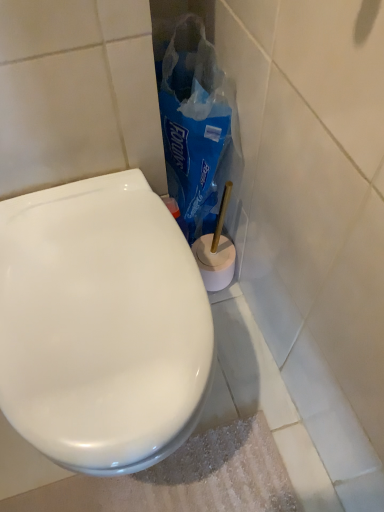
Question: Does white glossy toilet seat at center appear on the right side of blue plastic bag at center?

Choices:
 (A) no
 (B) yes

Answer: (A)

Question: From a real-world perspective, does white glossy toilet seat at center stand above blue plastic bag at center?

Choices:
 (A) yes
 (B) no

Answer: (B)

Question: Is white glossy toilet seat at center at the left side of blue plastic bag at center?

Choices:
 (A) yes
 (B) no

Answer: (A)

Question: Would you say white glossy toilet seat at center contains blue plastic bag at center?

Choices:
 (A) yes
 (B) no

Answer: (B)

Question: Is the depth of white glossy toilet seat at center greater than that of blue plastic bag at center?

Choices:
 (A) no
 (B) yes

Answer: (A)

Question: Is white glossy toilet seat at center with blue plastic bag at center?

Choices:
 (A) no
 (B) yes

Answer: (A)

Question: Is white glossy toilet seat at center at the back of blue plastic bag at center?

Choices:
 (A) no
 (B) yes

Answer: (A)

Question: Is blue plastic bag at center further to camera compared to white glossy toilet seat at center?

Choices:
 (A) no
 (B) yes

Answer: (B)

Question: Considering the relative sizes of blue plastic bag at center and white glossy toilet seat at center in the image provided, is blue plastic bag at center bigger than white glossy toilet seat at center?

Choices:
 (A) no
 (B) yes

Answer: (A)

Question: Considering the relative sizes of blue plastic bag at center and white glossy toilet seat at center in the image provided, is blue plastic bag at center taller than white glossy toilet seat at center?

Choices:
 (A) yes
 (B) no

Answer: (A)

Question: Considering the relative positions of blue plastic bag at center and white glossy toilet seat at center in the image provided, is blue plastic bag at center to the left of white glossy toilet seat at center from the viewer's perspective?

Choices:
 (A) no
 (B) yes

Answer: (A)

Question: Does blue plastic bag at center have a smaller size compared to white glossy toilet seat at center?

Choices:
 (A) no
 (B) yes

Answer: (B)

Question: Is blue plastic bag at center in front of or behind white glossy toilet seat at center in the image?

Choices:
 (A) front
 (B) behind

Answer: (B)